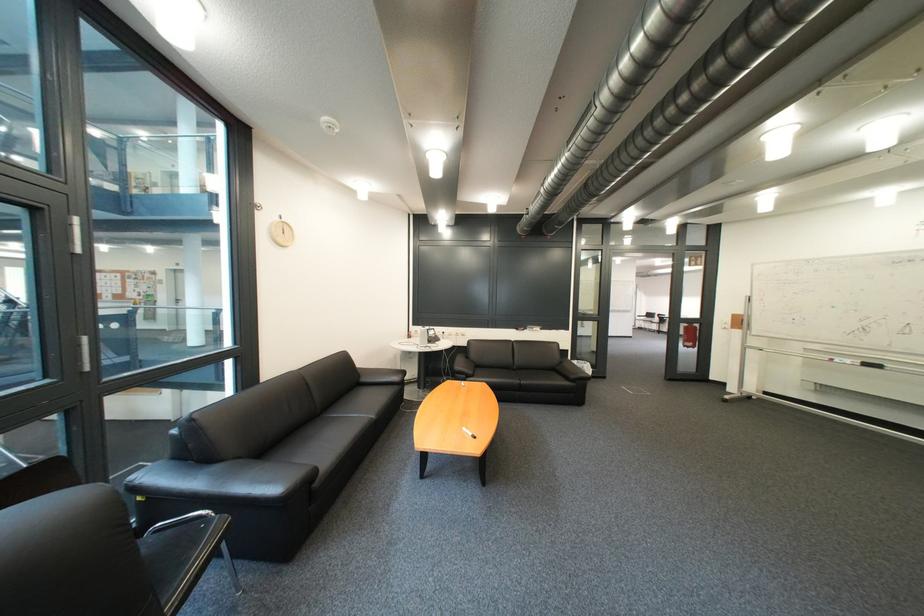
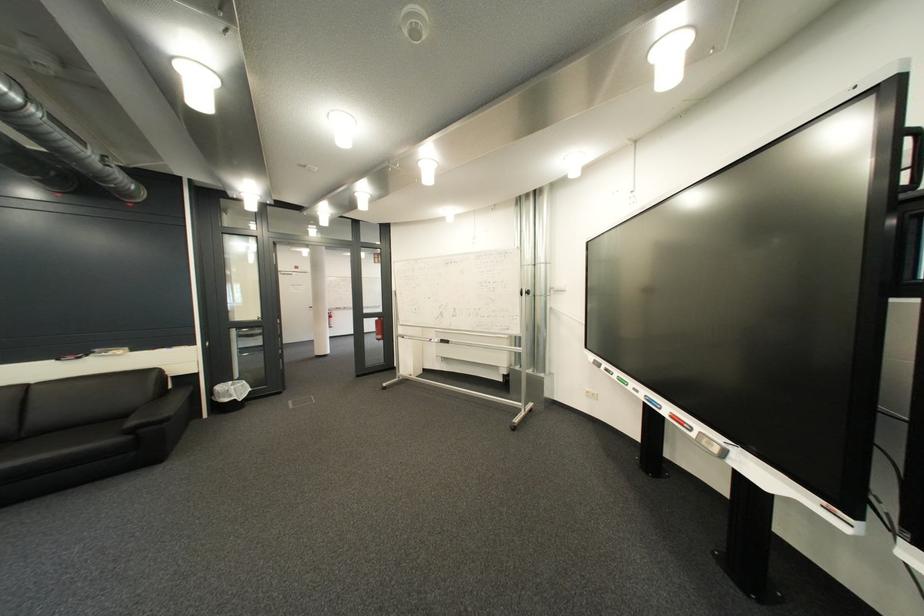
Where in the second image is the point corresponding to (845,361) from the first image?

(444, 341)